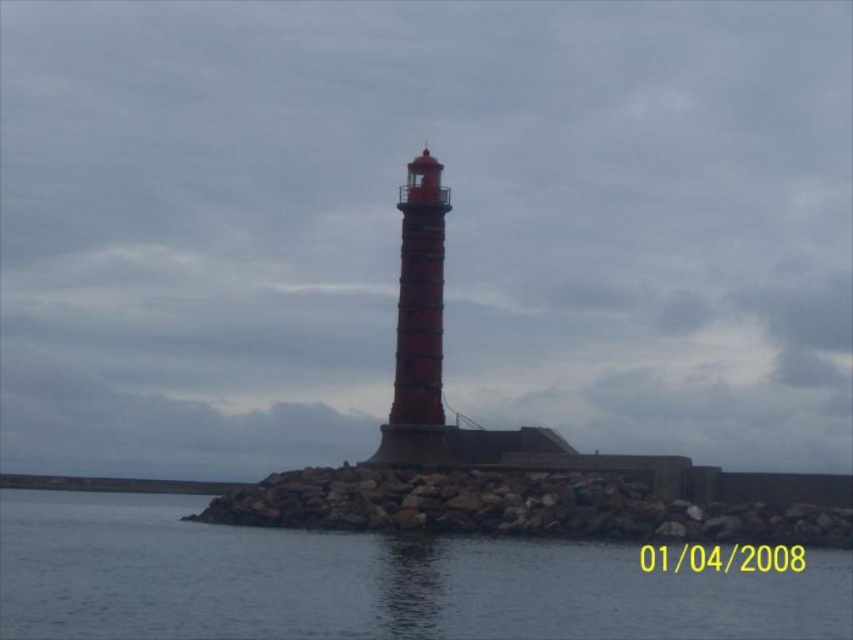
Does transparent water at lower center come in front of rocky at center?

Yes, it is.

Who is higher up, transparent water at lower center or rocky at center?

Positioned higher is rocky at center.

Is point (581, 605) behind point (422, 493)?

No, (581, 605) is closer to viewer.

This screenshot has width=853, height=640. What are the coordinates of `transparent water at lower center` in the screenshot? It's located at (366, 580).

Is transparent water at lower center shorter than red brick lighthouse at center?

Yes.

Is transparent water at lower center above red brick lighthouse at center?

No, transparent water at lower center is not above red brick lighthouse at center.

Which is in front, point (200, 624) or point (415, 349)?

Point (200, 624) is more forward.

This screenshot has width=853, height=640. Identify the location of transparent water at lower center. (366, 580).

Does rocky at center come in front of red brick lighthouse at center?

That is True.

Between rocky at center and red brick lighthouse at center, which one is positioned higher?

red brick lighthouse at center is above.

In order to click on rocky at center in this screenshot , I will do `click(524, 506)`.

Where is `rocky at center`? This screenshot has width=853, height=640. rocky at center is located at coordinates (524, 506).